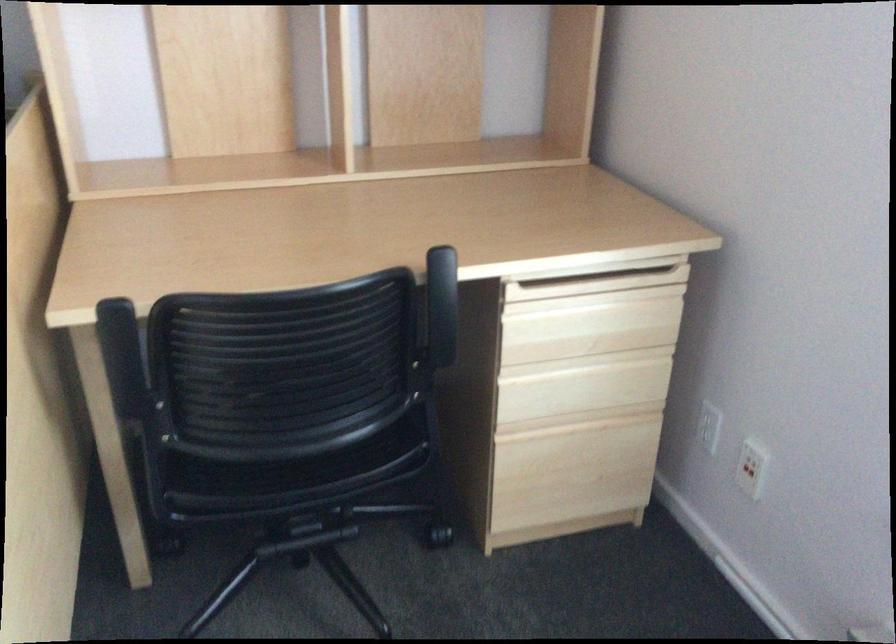
This screenshot has width=896, height=644. I want to click on chair sitting surface, so click(x=296, y=455).